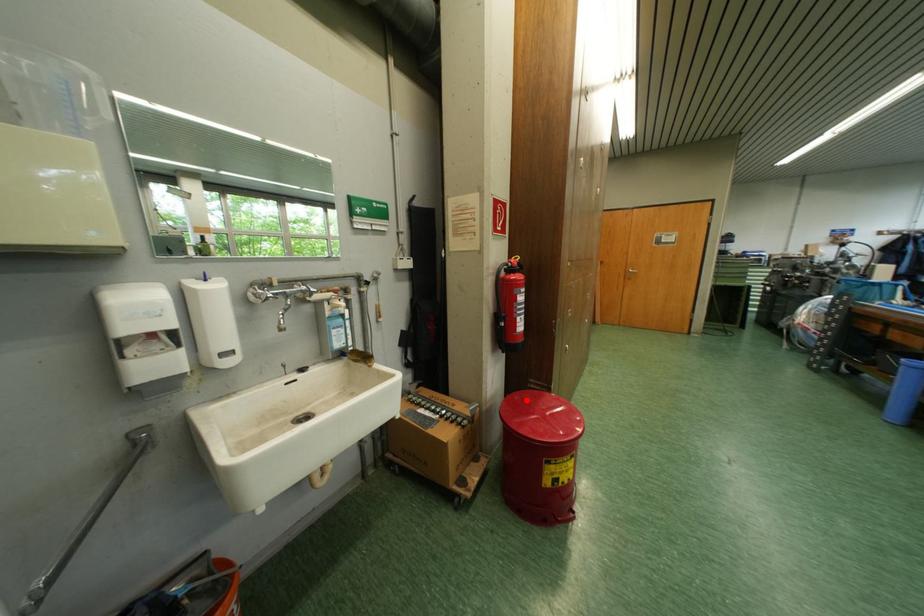
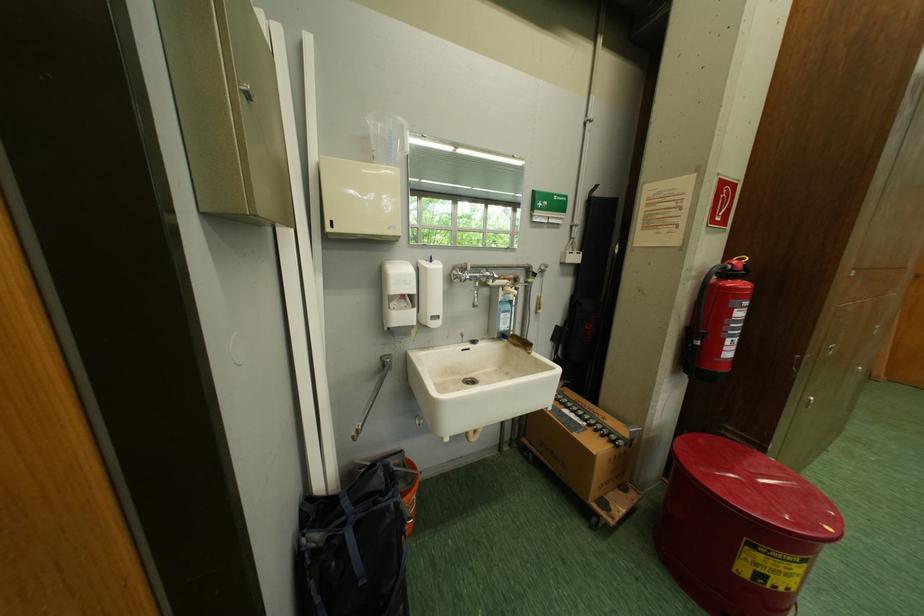
Where in the second image is the point corresponding to the highlighted location from the first image?

(711, 443)